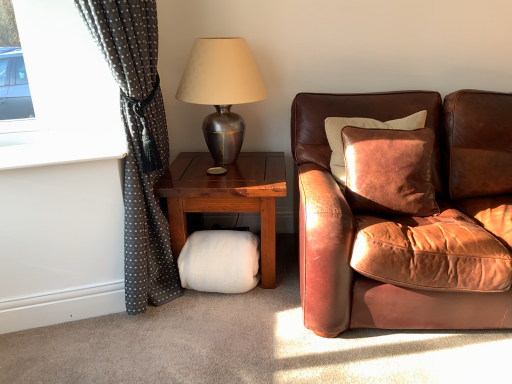
Question: Can you see white fluffy pillow at lower center touching white fluffy footrest at lower center?

Choices:
 (A) no
 (B) yes

Answer: (A)

Question: Is white fluffy pillow at lower center oriented away from white fluffy footrest at lower center?

Choices:
 (A) yes
 (B) no

Answer: (B)

Question: Can you confirm if white fluffy pillow at lower center is smaller than white fluffy footrest at lower center?

Choices:
 (A) no
 (B) yes

Answer: (A)

Question: From the image's perspective, would you say white fluffy pillow at lower center is positioned over white fluffy footrest at lower center?

Choices:
 (A) yes
 (B) no

Answer: (A)

Question: From a real-world perspective, is white fluffy pillow at lower center over white fluffy footrest at lower center?

Choices:
 (A) no
 (B) yes

Answer: (B)

Question: From the image's perspective, is brown leather couch at right above or below dark grey polka dot fabric at left?

Choices:
 (A) below
 (B) above

Answer: (A)

Question: Relative to dark grey polka dot fabric at left, is brown leather couch at right in front or behind?

Choices:
 (A) behind
 (B) front

Answer: (A)

Question: From a real-world perspective, relative to dark grey polka dot fabric at left, is brown leather couch at right vertically above or below?

Choices:
 (A) below
 (B) above

Answer: (A)

Question: Is brown leather couch at right inside the boundaries of dark grey polka dot fabric at left, or outside?

Choices:
 (A) outside
 (B) inside

Answer: (A)

Question: From their relative heights in the image, would you say metallic silver lamp at upper center is taller or shorter than brown leather couch at right?

Choices:
 (A) short
 (B) tall

Answer: (A)

Question: From a real-world perspective, relative to brown leather couch at right, is metallic silver lamp at upper center vertically above or below?

Choices:
 (A) below
 (B) above

Answer: (B)

Question: Considering the relative positions of metallic silver lamp at upper center and brown leather couch at right in the image provided, is metallic silver lamp at upper center to the left or to the right of brown leather couch at right?

Choices:
 (A) left
 (B) right

Answer: (A)

Question: Considering the positions of metallic silver lamp at upper center and brown leather couch at right in the image, is metallic silver lamp at upper center bigger or smaller than brown leather couch at right?

Choices:
 (A) big
 (B) small

Answer: (B)

Question: From the image's perspective, is white fluffy pillow at lower center above or below metallic silver lamp at upper center?

Choices:
 (A) above
 (B) below

Answer: (B)

Question: Is white fluffy pillow at lower center in front of or behind metallic silver lamp at upper center in the image?

Choices:
 (A) front
 (B) behind

Answer: (B)